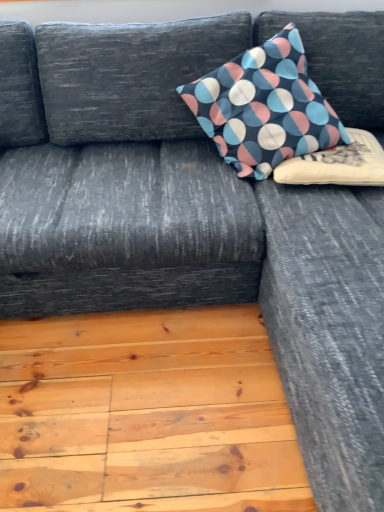
Question: Which direction should I rotate to look at patterned fabric pillow at upper center, positioned as the 1th pillow in top-to-bottom order?

Choices:
 (A) right
 (B) left

Answer: (A)

Question: Is soft cotton cushion at upper right, the 2th pillow when ordered from top to bottom, shorter than patterned fabric pillow at upper center, positioned as the 1th pillow in top-to-bottom order?

Choices:
 (A) yes
 (B) no

Answer: (A)

Question: Can you confirm if soft cotton cushion at upper right, the 1th pillow in the bottom-to-top sequence, is smaller than patterned fabric pillow at upper center, positioned as the 1th pillow in top-to-bottom order?

Choices:
 (A) no
 (B) yes

Answer: (B)

Question: Is soft cotton cushion at upper right, the 2th pillow when ordered from top to bottom, wider than patterned fabric pillow at upper center, positioned as the 1th pillow in top-to-bottom order?

Choices:
 (A) yes
 (B) no

Answer: (B)

Question: Is soft cotton cushion at upper right, the 1th pillow in the bottom-to-top sequence, surrounding patterned fabric pillow at upper center, the 2th pillow when ordered from bottom to top?

Choices:
 (A) yes
 (B) no

Answer: (B)

Question: Is soft cotton cushion at upper right, the 2th pillow when ordered from top to bottom, far from patterned fabric pillow at upper center, the 2th pillow when ordered from bottom to top?

Choices:
 (A) no
 (B) yes

Answer: (A)

Question: Is the surface of soft cotton cushion at upper right, the 2th pillow when ordered from top to bottom, in direct contact with patterned fabric pillow at upper center, the 2th pillow when ordered from bottom to top?

Choices:
 (A) no
 (B) yes

Answer: (A)

Question: From a real-world perspective, does patterned fabric pillow at upper center, positioned as the 1th pillow in top-to-bottom order, sit lower than soft cotton cushion at upper right, the 2th pillow when ordered from top to bottom?

Choices:
 (A) no
 (B) yes

Answer: (A)

Question: Does patterned fabric pillow at upper center, positioned as the 1th pillow in top-to-bottom order, appear on the left side of soft cotton cushion at upper right, the 1th pillow in the bottom-to-top sequence?

Choices:
 (A) no
 (B) yes

Answer: (B)

Question: Is patterned fabric pillow at upper center, positioned as the 1th pillow in top-to-bottom order, not near soft cotton cushion at upper right, the 1th pillow in the bottom-to-top sequence?

Choices:
 (A) yes
 (B) no

Answer: (B)

Question: From the image's perspective, is patterned fabric pillow at upper center, positioned as the 1th pillow in top-to-bottom order, located above soft cotton cushion at upper right, the 1th pillow in the bottom-to-top sequence?

Choices:
 (A) yes
 (B) no

Answer: (A)

Question: Is patterned fabric pillow at upper center, the 2th pillow when ordered from bottom to top, bigger than soft cotton cushion at upper right, the 1th pillow in the bottom-to-top sequence?

Choices:
 (A) no
 (B) yes

Answer: (B)

Question: Does patterned fabric pillow at upper center, positioned as the 1th pillow in top-to-bottom order, appear on the right side of soft cotton cushion at upper right, the 2th pillow when ordered from top to bottom?

Choices:
 (A) no
 (B) yes

Answer: (A)

Question: Is point [367, 140] closer or farther from the camera than point [261, 59]?

Choices:
 (A) closer
 (B) farther

Answer: (B)